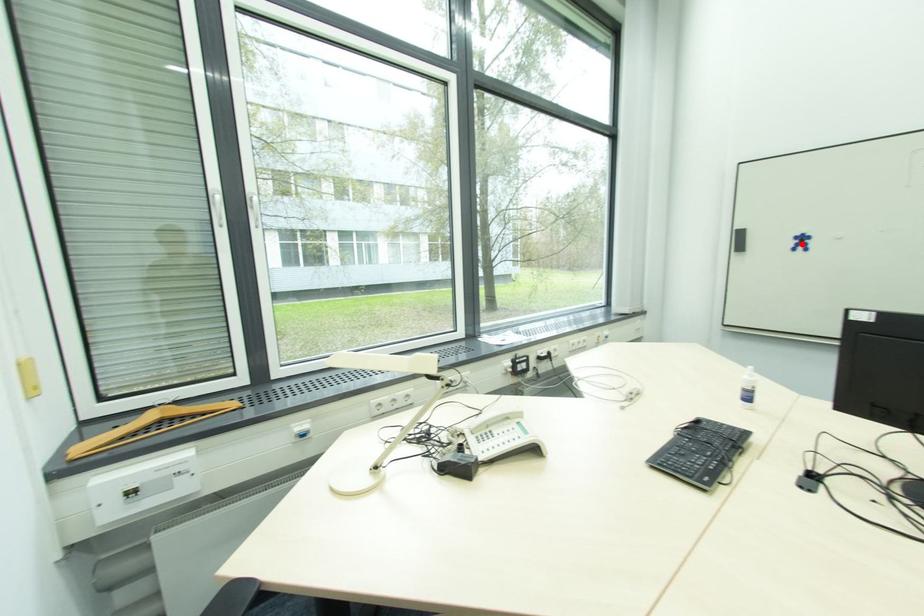
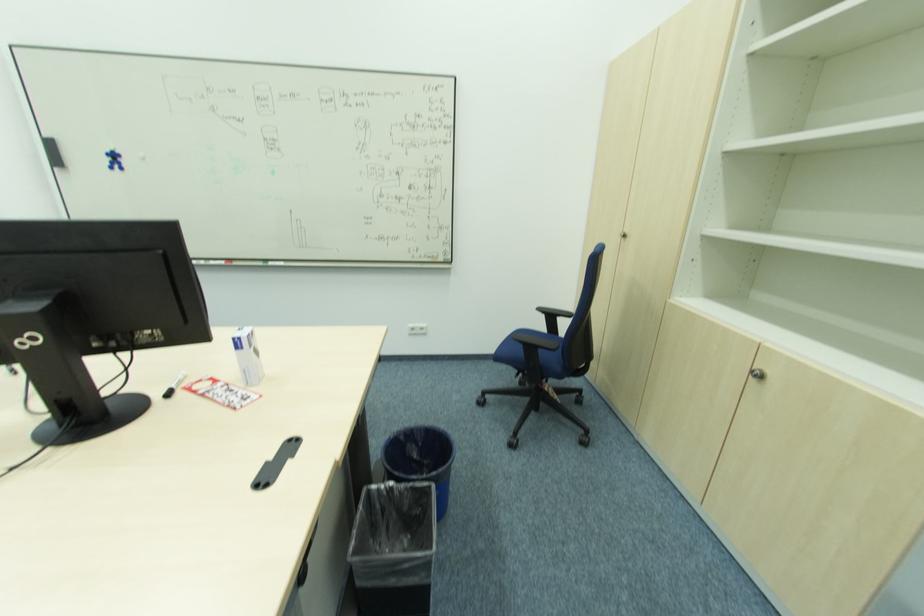
The point at the highlighted location is marked in the first image. Where is the corresponding point in the second image?

(116, 161)